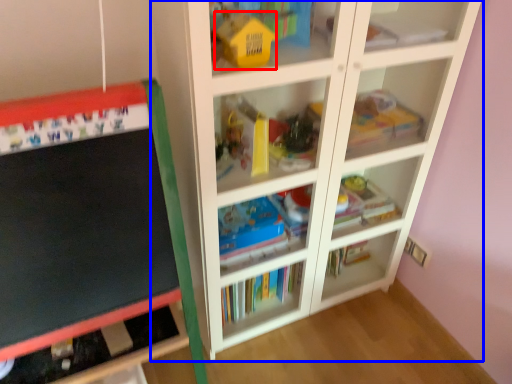
Question: Which object is further to the camera taking this photo, toy (highlighted by a red box) or shelf (highlighted by a blue box)?

Choices:
 (A) toy
 (B) shelf

Answer: (A)